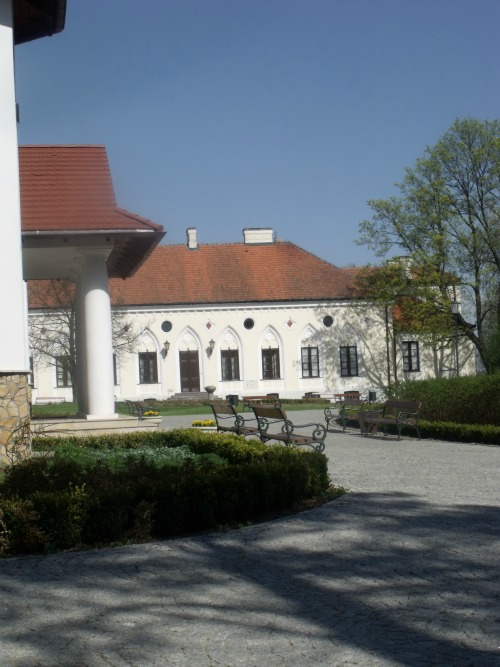
Identify the location of chimney. This screenshot has width=500, height=667. (191, 235).